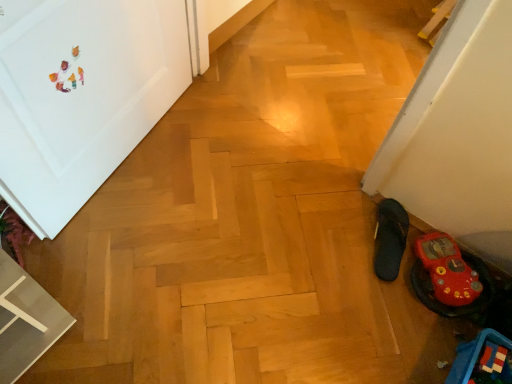
Question: Is rubber flip-flop at lower right, which is the 2th footwear in left-to-right order, at the left side of white matte door at upper left?

Choices:
 (A) no
 (B) yes

Answer: (A)

Question: Considering the relative sizes of rubber flip-flop at lower right, acting as the 1th footwear starting from the right, and white matte door at upper left in the image provided, is rubber flip-flop at lower right, acting as the 1th footwear starting from the right, wider than white matte door at upper left?

Choices:
 (A) yes
 (B) no

Answer: (A)

Question: Is rubber flip-flop at lower right, which is the 2th footwear in left-to-right order, directly adjacent to white matte door at upper left?

Choices:
 (A) no
 (B) yes

Answer: (A)

Question: Is rubber flip-flop at lower right, which is the 2th footwear in left-to-right order, aimed at white matte door at upper left?

Choices:
 (A) no
 (B) yes

Answer: (A)

Question: Is white matte door at upper left inside rubber flip-flop at lower right, which is the 2th footwear in left-to-right order?

Choices:
 (A) no
 (B) yes

Answer: (A)

Question: Does rubber flip-flop at lower right, which is the 2th footwear in left-to-right order, have a lesser width compared to white matte door at upper left?

Choices:
 (A) yes
 (B) no

Answer: (B)

Question: Considering the relative positions of rubber flip-flop at lower right, acting as the 1th footwear starting from the right, and blue plastic toy at lower right in the image provided, is rubber flip-flop at lower right, acting as the 1th footwear starting from the right, behind blue plastic toy at lower right?

Choices:
 (A) yes
 (B) no

Answer: (A)

Question: Considering the relative sizes of rubber flip-flop at lower right, which is the 2th footwear in left-to-right order, and blue plastic toy at lower right in the image provided, is rubber flip-flop at lower right, which is the 2th footwear in left-to-right order, bigger than blue plastic toy at lower right?

Choices:
 (A) yes
 (B) no

Answer: (B)

Question: From the image's perspective, is rubber flip-flop at lower right, acting as the 1th footwear starting from the right, on top of blue plastic toy at lower right?

Choices:
 (A) no
 (B) yes

Answer: (B)

Question: From a real-world perspective, is rubber flip-flop at lower right, which is the 2th footwear in left-to-right order, located beneath blue plastic toy at lower right?

Choices:
 (A) no
 (B) yes

Answer: (B)

Question: Can you confirm if rubber flip-flop at lower right, which is the 2th footwear in left-to-right order, is shorter than blue plastic toy at lower right?

Choices:
 (A) no
 (B) yes

Answer: (B)

Question: Considering the relative sizes of rubber flip-flop at lower right, acting as the 1th footwear starting from the right, and blue plastic toy at lower right in the image provided, is rubber flip-flop at lower right, acting as the 1th footwear starting from the right, smaller than blue plastic toy at lower right?

Choices:
 (A) no
 (B) yes

Answer: (B)

Question: From a real-world perspective, is blue plastic toy at lower right physically below black fabric slipper at lower right, positioned as the 1th footwear in left-to-right order?

Choices:
 (A) yes
 (B) no

Answer: (B)